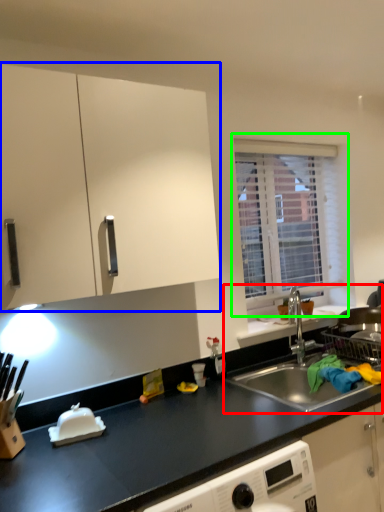
Question: Which object is the closest to the sink (highlighted by a red box)? Choose among these: cabinetry (highlighted by a blue box) or window (highlighted by a green box).

Choices:
 (A) cabinetry
 (B) window

Answer: (B)